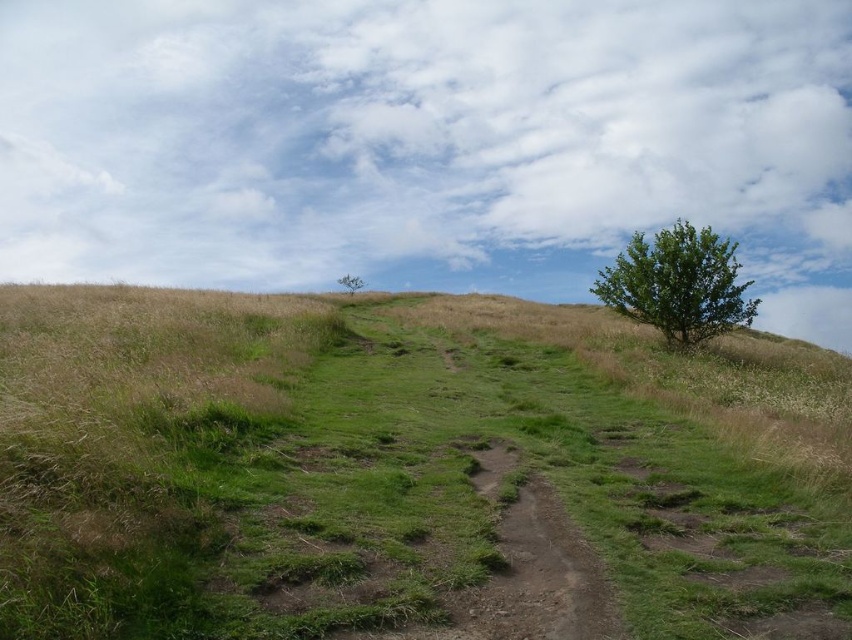
Question: Estimate the real-world distances between objects in this image. Which object is farther from the dull brown dirt track at center?

Choices:
 (A) green leafy tree at center
 (B) green grassy at center

Answer: (A)

Question: Can you confirm if green grassy at center is positioned to the right of green leafy tree at center?

Choices:
 (A) no
 (B) yes

Answer: (B)

Question: Does green grassy at center appear on the left side of green leafy tree at right?

Choices:
 (A) no
 (B) yes

Answer: (B)

Question: Does green grassy at center appear on the right side of green leafy tree at right?

Choices:
 (A) no
 (B) yes

Answer: (A)

Question: Considering the real-world distances, which object is closest to the green leafy tree at center?

Choices:
 (A) green grassy at center
 (B) green leafy tree at right
 (C) dull brown dirt track at center

Answer: (A)

Question: Which point is farther to the camera?

Choices:
 (A) green leafy tree at right
 (B) dull brown dirt track at center
 (C) green leafy tree at center

Answer: (C)